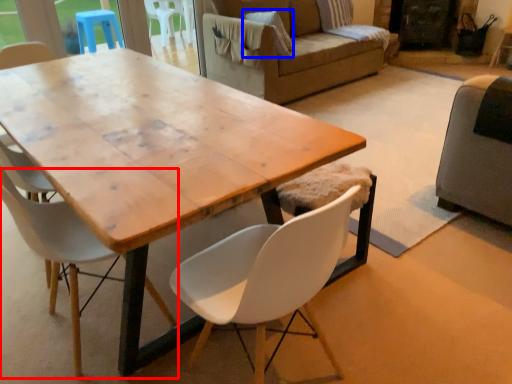
Question: Which object is further to the camera taking this photo, chair (highlighted by a red box) or pillow (highlighted by a blue box)?

Choices:
 (A) chair
 (B) pillow

Answer: (B)